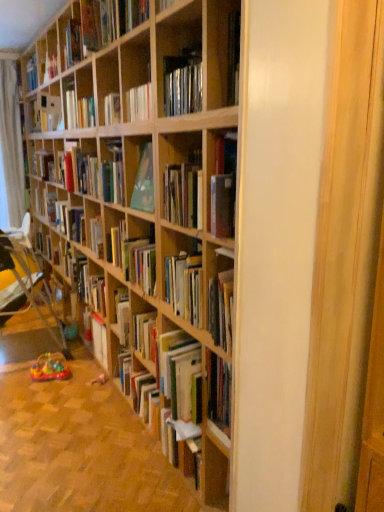
Question: From a real-world perspective, is wooden bookcase at center physically located above or below hardcover book at center, the fourth book in the top-to-bottom sequence?

Choices:
 (A) above
 (B) below

Answer: (A)

Question: Is wooden bookcase at center wider or thinner than hardcover book at center, the 1th book in the bottom-to-top sequence?

Choices:
 (A) wide
 (B) thin

Answer: (B)

Question: Which object is positioned farthest from the hardcover book at upper left, marked as the first book in a top-to-bottom arrangement?

Choices:
 (A) wooden bookcase at center
 (B) matte red book at center, the second book from the top
 (C) hardcover book at center, the third book when ordered from top to bottom
 (D) plastic multicolored toy at lower left
 (E) hardcover book at center, the 1th book in the bottom-to-top sequence

Answer: (D)

Question: Estimate the real-world distances between objects in this image. Which object is farther from the hardcover book at center, the 1th book in the bottom-to-top sequence?

Choices:
 (A) white sheer curtain at left
 (B) matte red book at center, the second book from the top
 (C) hardcover book at center, the third book when ordered from top to bottom
 (D) wooden bookcase at center
 (E) plastic multicolored toy at lower left

Answer: (A)